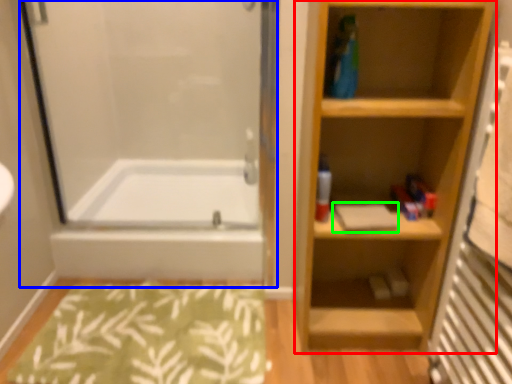
Question: Based on their relative distances, which object is farther from bookshelf (highlighted by a red box)? Choose from screen door (highlighted by a blue box) and book (highlighted by a green box).

Choices:
 (A) screen door
 (B) book

Answer: (A)